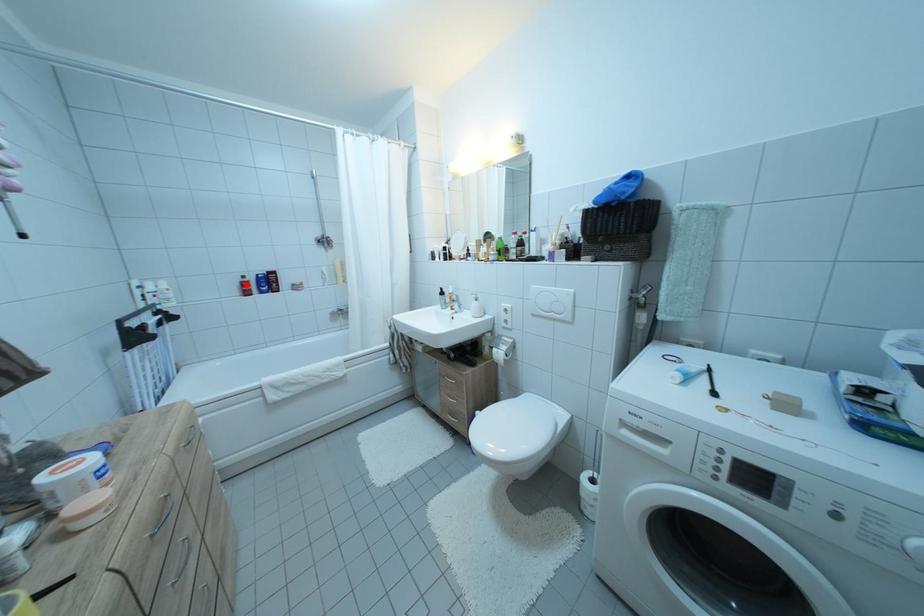
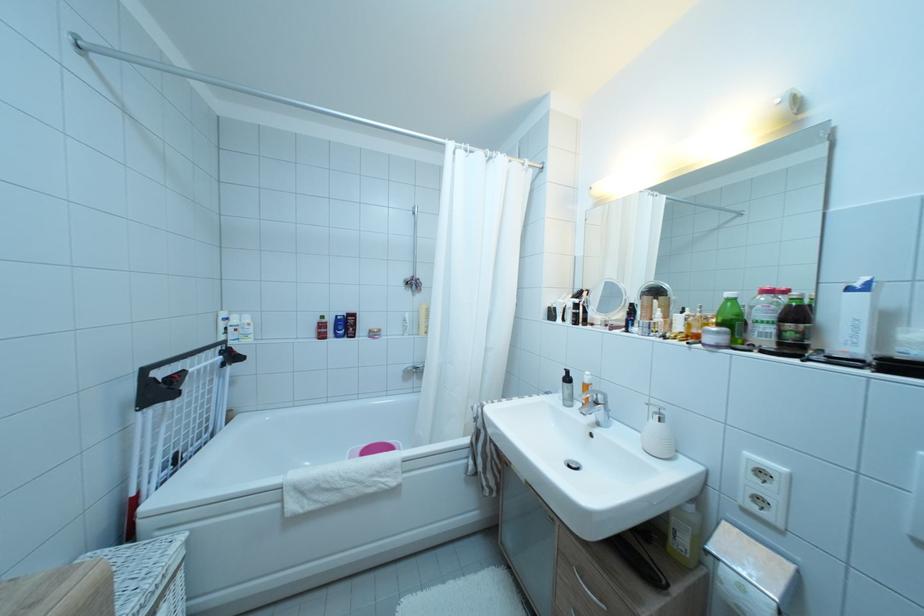
The point at the highlighted location is marked in the first image. Where is the corresponding point in the second image?

(324, 325)